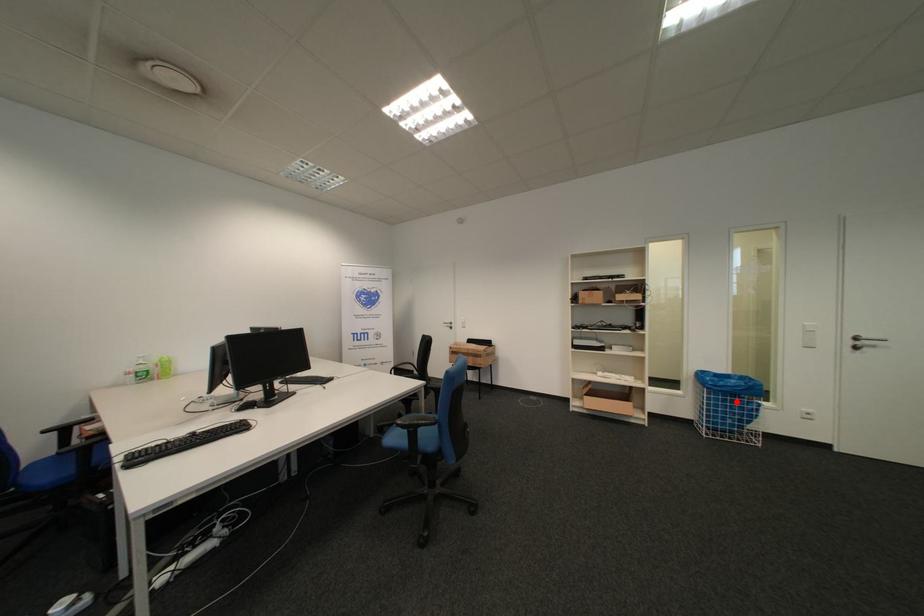
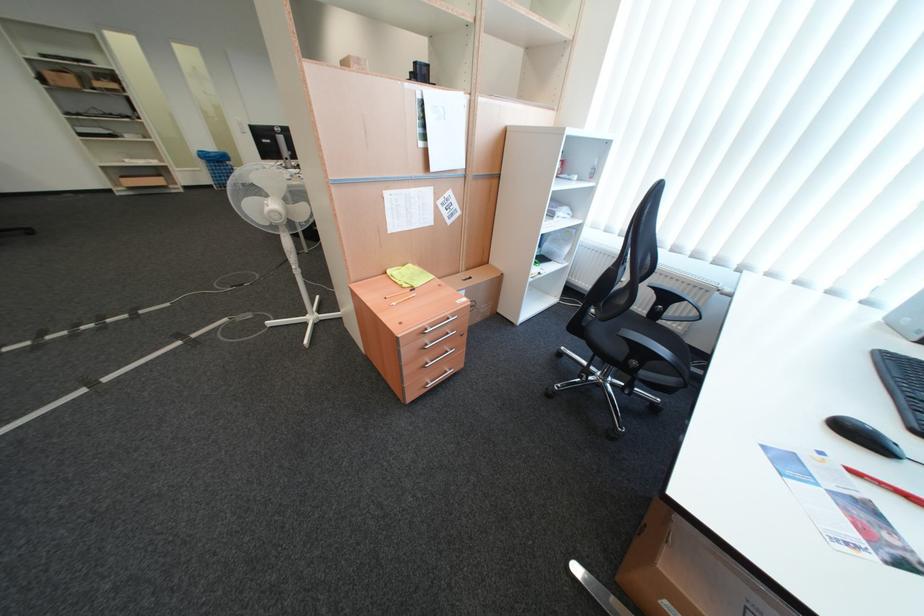
Where in the second image is the point corresponding to the highlighted location from the first image?

(227, 168)